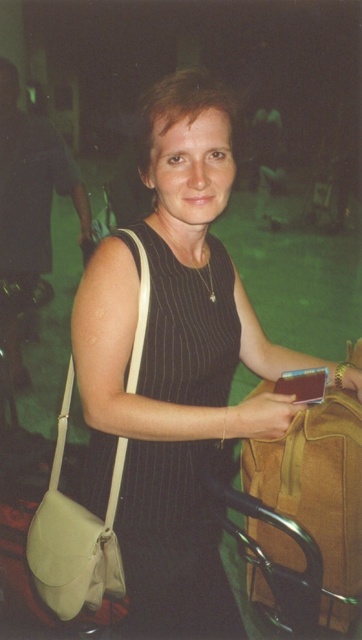
You are a fashion designer observing the scene. You notice the matte black dress at center and the black pinstripe dress at center. Which dress has a wider silhouette?

The matte black dress at center has a larger width than the black pinstripe dress at center, so the matte black dress at center has a wider silhouette.

You are a photographer trying to focus on the person in the image. The camera has a focus point at coordinates point (175, 364). Where is the focus point located on the person?

The focus point at point (175, 364) is located on the matte black dress at center.